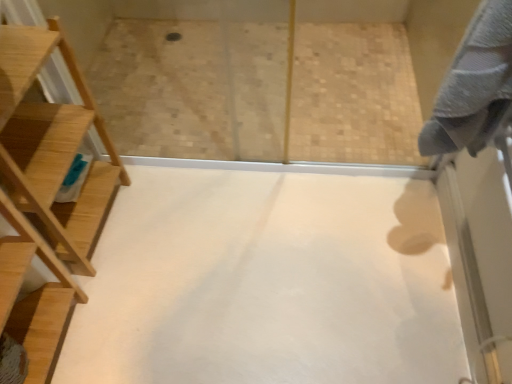
Question: Is gray cotton bath towel at upper right taller or shorter than natural wood ladder at left?

Choices:
 (A) short
 (B) tall

Answer: (A)

Question: In terms of width, does gray cotton bath towel at upper right look wider or thinner when compared to natural wood ladder at left?

Choices:
 (A) thin
 (B) wide

Answer: (A)

Question: Which object is positioned closest to the white matte floor at center?

Choices:
 (A) gray cotton bath towel at upper right
 (B) natural wood ladder at left

Answer: (B)

Question: Considering the real-world distances, which object is closest to the white matte floor at center?

Choices:
 (A) natural wood ladder at left
 (B) gray cotton bath towel at upper right

Answer: (A)